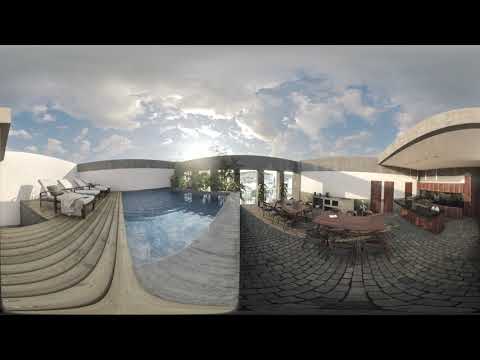
Where is `ceiling`? Image resolution: width=480 pixels, height=360 pixels. ceiling is located at coordinates (455, 157).